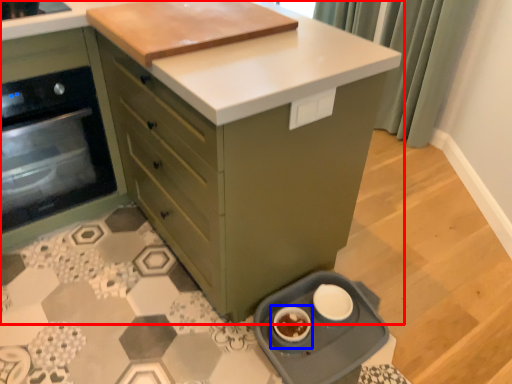
Question: Which object appears closest to the camera in this image, cabinetry (highlighted by a red box) or appliance (highlighted by a blue box)?

Choices:
 (A) cabinetry
 (B) appliance

Answer: (A)